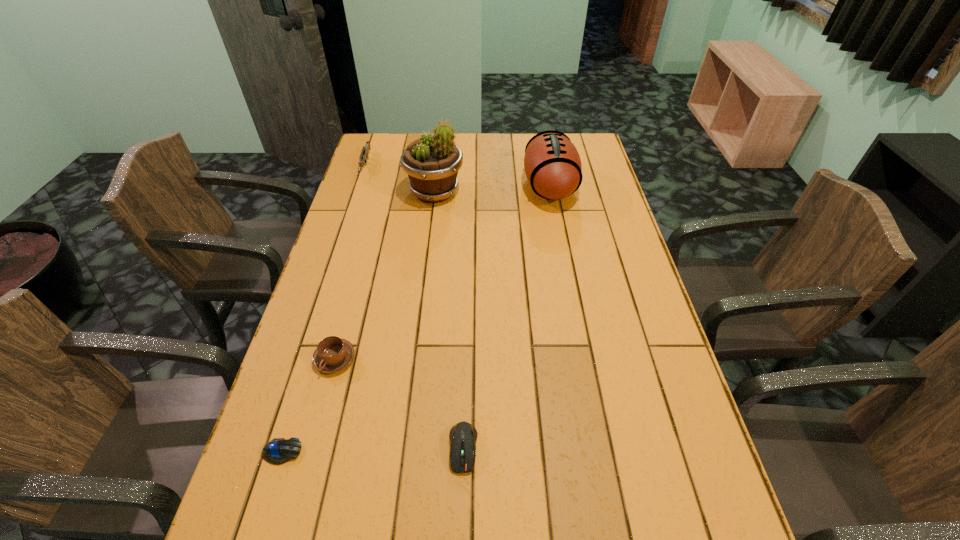
You are a GUI agent. You are given a task and a screenshot of the screen. Output one action in this format:
    pyautogui.click(x=<x>, y=<y>)
    Task: Click on the flowerpot
    
    Given the screenshot: What is the action you would take?
    pyautogui.click(x=432, y=162)

The width and height of the screenshot is (960, 540). I want to click on the second tallest object, so click(x=552, y=164).

Find the location of a particular element. The height and width of the screenshot is (540, 960). the rightmost object is located at coordinates 552,164.

Find the location of a particular element. The image size is (960, 540). gun is located at coordinates (364, 156).

The height and width of the screenshot is (540, 960). I want to click on the third nearest object, so click(333, 354).

Locate an element on the screen. the third shortest object is located at coordinates (333, 354).

Find the location of `the taller computer mouse`. the taller computer mouse is located at coordinates 463,435.

Locate an element on the screen. This screenshot has height=540, width=960. the right computer mouse is located at coordinates (463, 435).

Locate an element on the screen. the left computer mouse is located at coordinates (279, 450).

You are a GUI agent. You are given a task and a screenshot of the screen. Output one action in this format:
    pyautogui.click(x=<x>, y=<y>)
    Task: Click on the shortest object
    
    Given the screenshot: What is the action you would take?
    pyautogui.click(x=279, y=450)